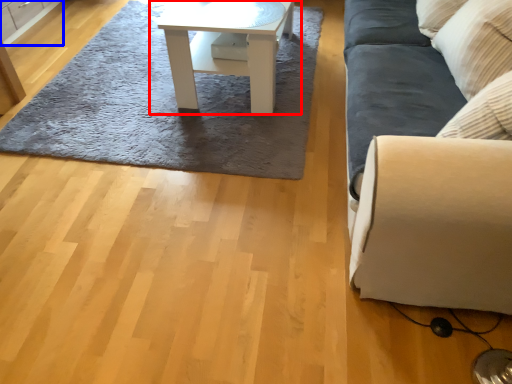
Question: Among these objects, which one is farthest to the camera, table (highlighted by a red box) or cabinetry (highlighted by a blue box)?

Choices:
 (A) table
 (B) cabinetry

Answer: (B)